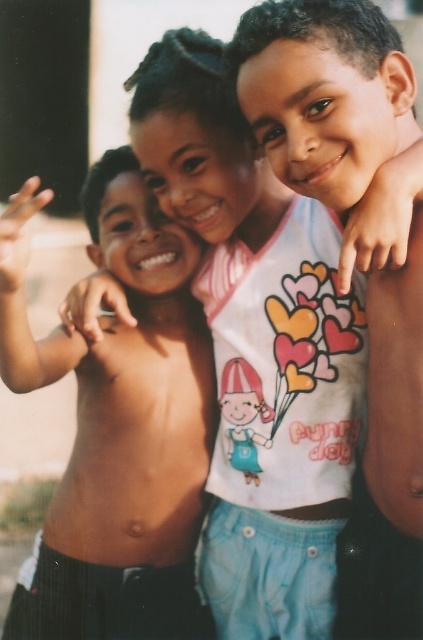
Question: Can you confirm if shiny skin at left is positioned to the right of smooth skin boy at center?

Choices:
 (A) yes
 (B) no

Answer: (B)

Question: Is shiny skin at left thinner than smooth skin boy at center?

Choices:
 (A) no
 (B) yes

Answer: (A)

Question: Can you confirm if shiny skin at left is thinner than smooth skin boy at center?

Choices:
 (A) no
 (B) yes

Answer: (A)

Question: Which of the following is the closest to the observer?

Choices:
 (A) (332, 189)
 (B) (192, 632)

Answer: (A)

Question: Among these objects, which one is farthest from the camera?

Choices:
 (A) smooth skin boy at center
 (B) shiny skin at left

Answer: (A)